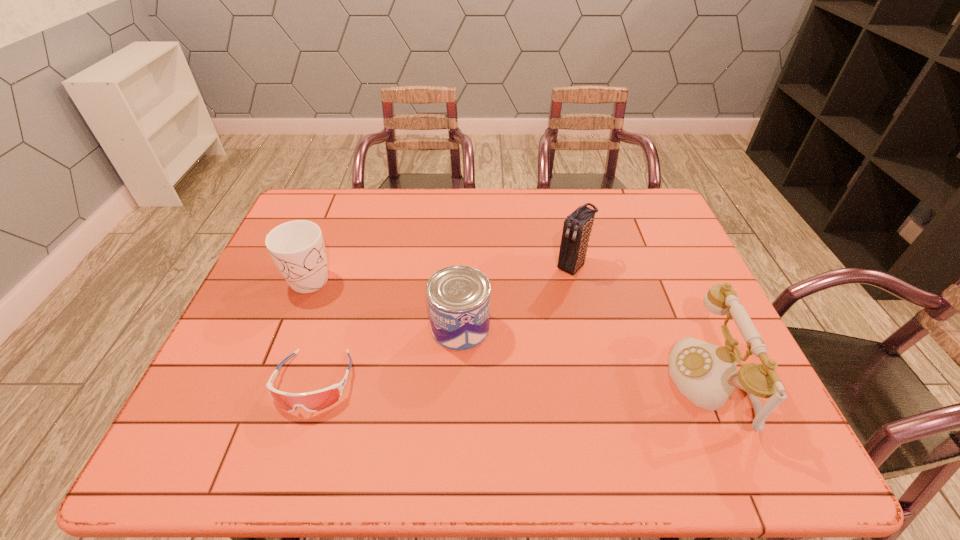
Identify the location of blank area located 0.170m on the side of the mug with the handle. The height and width of the screenshot is (540, 960). pyautogui.click(x=374, y=314).

Find the location of `free space located 0.250m on the front label of the can`. free space located 0.250m on the front label of the can is located at coordinates [x=578, y=388].

I want to click on vacant area situated 0.330m on the front label of the can, so (x=612, y=405).

You are a GUI agent. You are given a task and a screenshot of the screen. Output one action in this format:
    pyautogui.click(x=<x>, y=<y>)
    Task: Click on the vacant region located 0.140m on the front label of the can
    The width and height of the screenshot is (960, 540).
    Given the screenshot: What is the action you would take?
    pyautogui.click(x=535, y=366)

I want to click on vacant region located 0.220m with the zip open on the clutch bag, so click(517, 321).

The width and height of the screenshot is (960, 540). In order to click on vacant area situated with the zip open on the clutch bag in this screenshot , I will do tap(527, 312).

At what (x,y) coordinates should I click in order to perform the action: click on vacant space located 0.180m with the zip open on the clutch bag. Please return your answer as a coordinate pair (x, y). This screenshot has height=540, width=960. Looking at the image, I should click on (527, 312).

Locate an element on the screen. This screenshot has width=960, height=540. goggles present at the near edge is located at coordinates (314, 401).

Locate an element on the screen. The height and width of the screenshot is (540, 960). telephone present at the near edge is located at coordinates (706, 374).

You are a GUI agent. You are given a task and a screenshot of the screen. Output one action in this format:
    pyautogui.click(x=<x>, y=<y>)
    Task: Click on the goggles located in the left edge section of the desktop
    
    Given the screenshot: What is the action you would take?
    pyautogui.click(x=314, y=401)